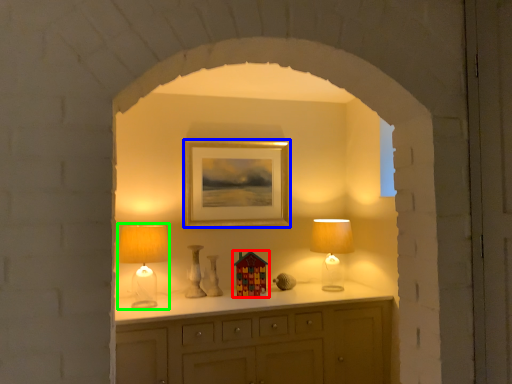
Question: Which object is the closest to the toy (highlighted by a red box)? Choose among these: picture frame (highlighted by a blue box) or table lamp (highlighted by a green box).

Choices:
 (A) picture frame
 (B) table lamp

Answer: (A)